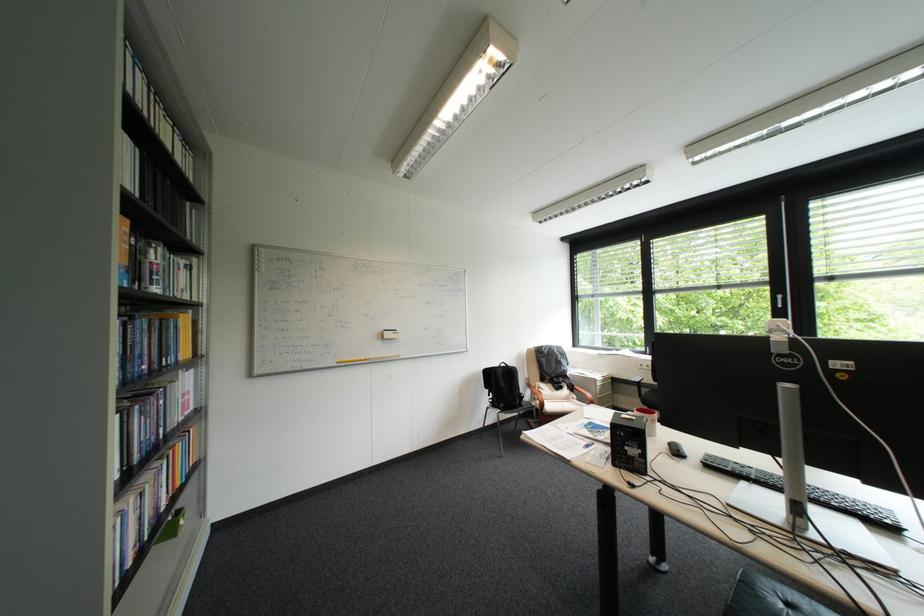
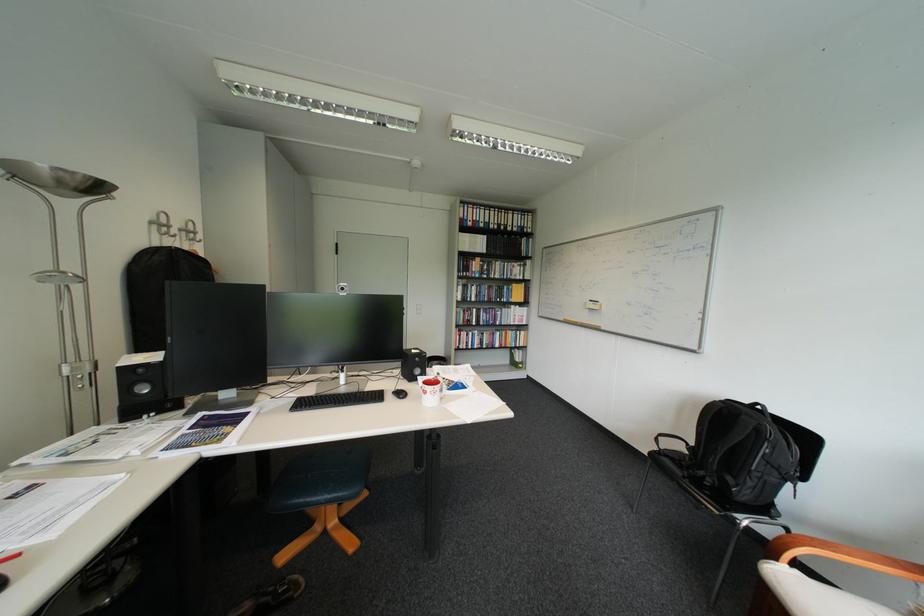
The point at (524, 369) is marked in the first image. Where is the corresponding point in the second image?

(756, 418)